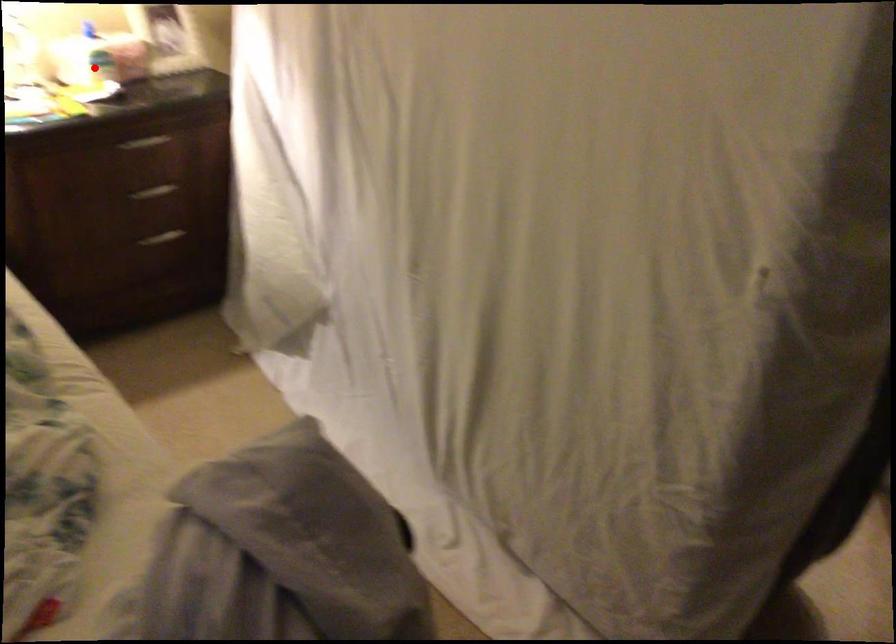
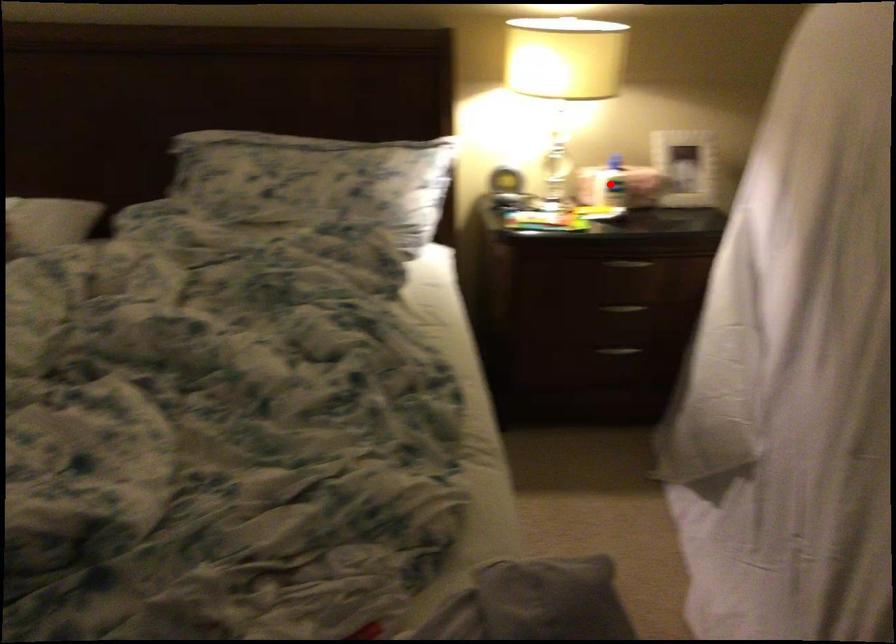
I am providing you with two images of the same scene from different viewpoints. A red point is marked on the first image and another point is marked on the second image. Is the marked point in image1 the same physical position as the marked point in image2?

Yes